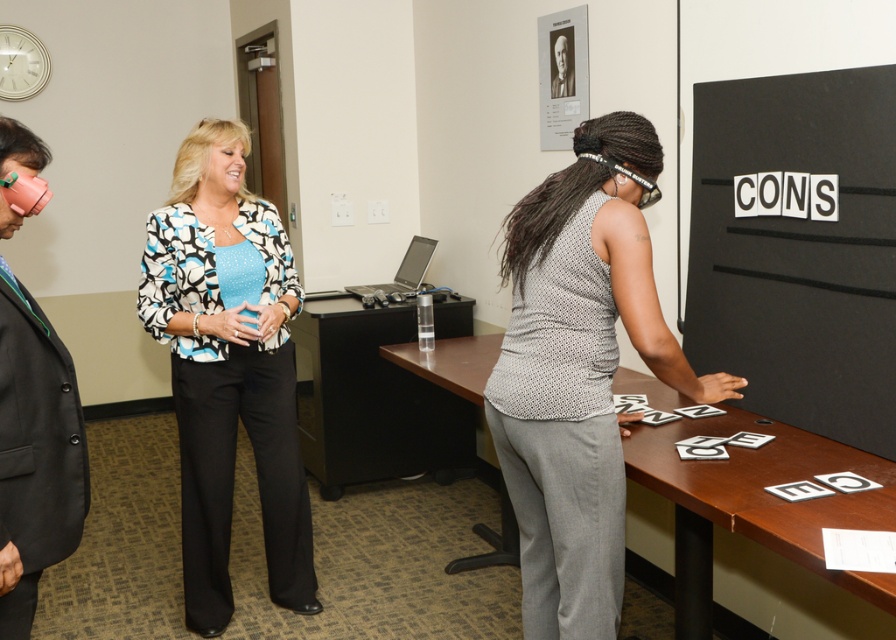
You are an interior designer assessing the placement of items in an office. The black matte board at right and the gray textured shirt at center are both part of the room decor. Which object is shorter in height?

The black matte board at right is not as tall as the gray textured shirt at center, so the black matte board at right is shorter in height.

You are a delivery person who needs to place a package that is 1.8 meters long on the floor in this office scene. Can the package fit between you and the black matte board at right without overlapping any objects?

The distance between the black matte board at right and the viewer is 1.79 meters. Since the package is 1.8 meters long, it would not fit as it is slightly longer than the available space.